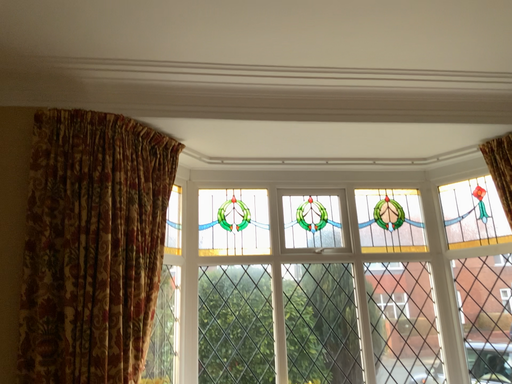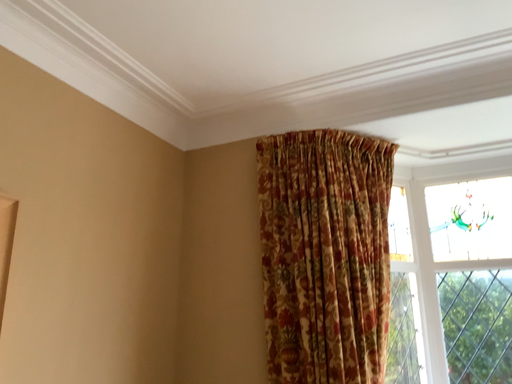
Question: Which way did the camera rotate in the video?

Choices:
 (A) rotated right
 (B) rotated left

Answer: (B)